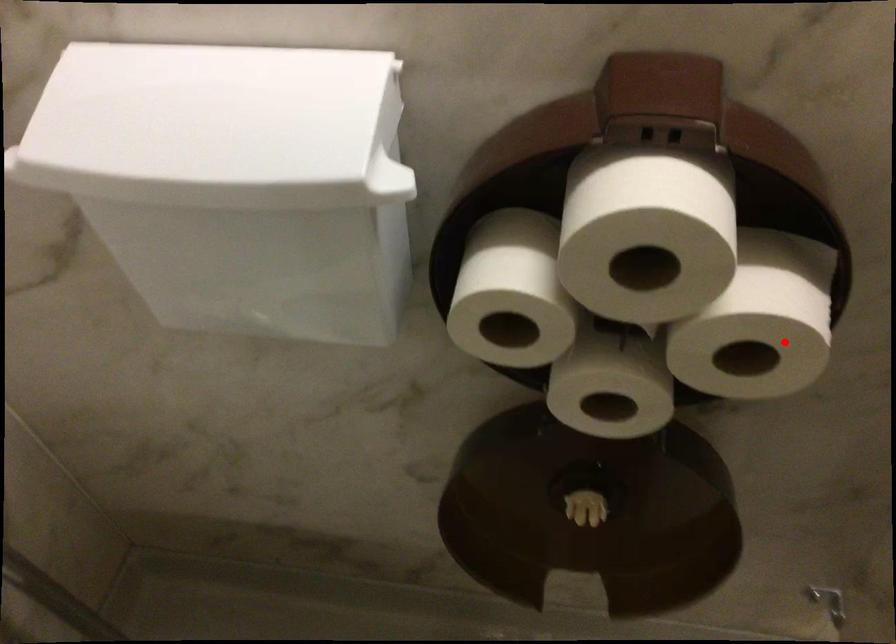
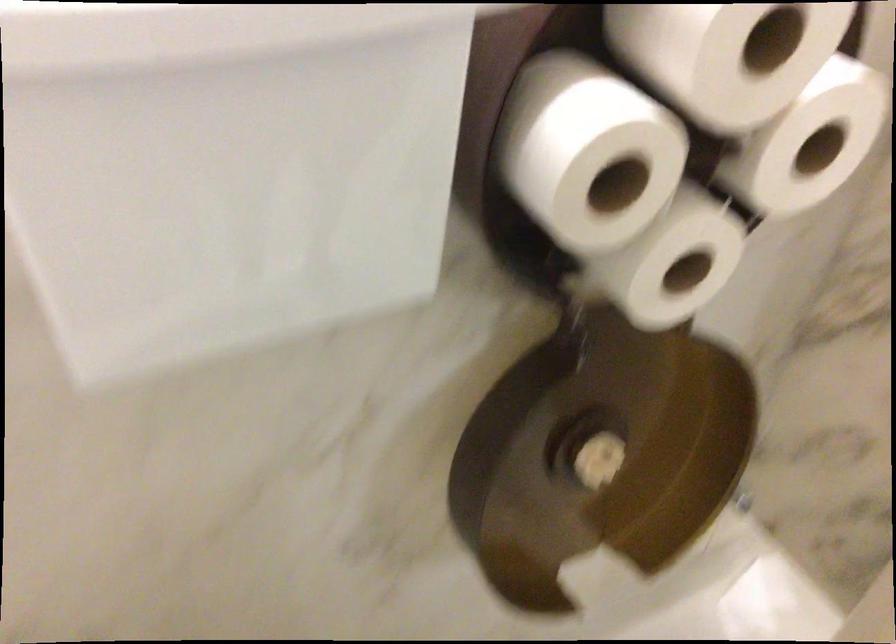
Find the pixel in the second image that matches the highlighted location in the first image.

(808, 142)